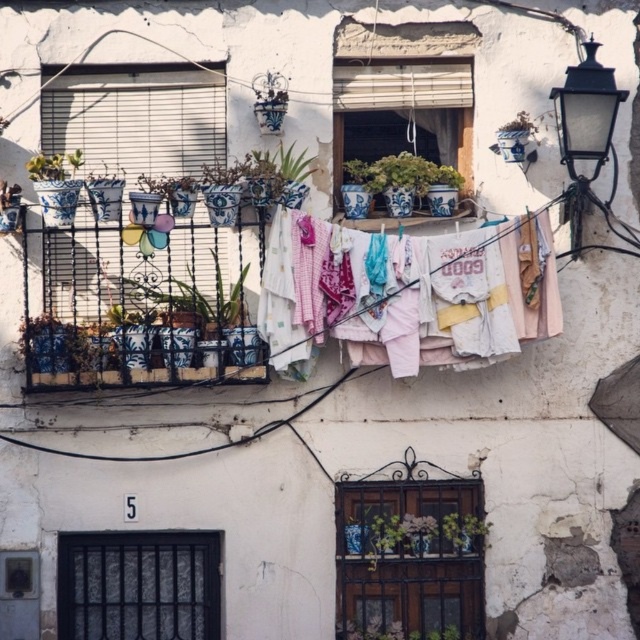
You are standing on the balcony and want to hang a large towel on the clothesline. The clothesline is attached to the black metal bars at lower left and the matte white window at upper center. Which object will the clothesline be closer to when it sags under the weight of the towel?

The clothesline will sag closer to the black metal bars at lower left because it is shorter than the matte white window at upper center, causing the line to dip more near the shorter support.

You are standing on the balcony and want to hang a new plant hanger between the blue and white ceramic pots at left and the black metal bars at lower left. Which object should the hanger be placed in front of to ensure it is visible from the balcony entrance?

The hanger should be placed in front of the blue and white ceramic pots at left because they are already in front of the black metal bars at lower left, so placing it there would keep it visible.

You are standing on the balcony and want to hang a new plant pot on the clothesline. The clothesline is currently holding the blue and white ceramic pots at left. Where should you place the new pot to avoid it colliding with the existing pots?

The blue and white ceramic pots at left are located at point (259, 308), so you should place the new pot in an area of the clothesline that is not occupied by these pots to avoid collision.